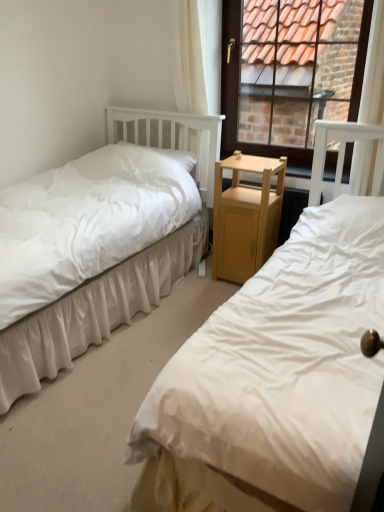
Question: Can you confirm if white fabric bed at left, the first bed positioned from the left, is positioned to the right of light wood nightstand at center?

Choices:
 (A) yes
 (B) no

Answer: (B)

Question: From the image's perspective, is white fabric bed at left, the first bed positioned from the left, on top of light wood nightstand at center?

Choices:
 (A) yes
 (B) no

Answer: (B)

Question: From a real-world perspective, is white fabric bed at left, the first bed positioned from the left, below light wood nightstand at center?

Choices:
 (A) no
 (B) yes

Answer: (A)

Question: Is white fabric bed at left, the first bed positioned from the left, turned away from light wood nightstand at center?

Choices:
 (A) yes
 (B) no

Answer: (B)

Question: Can you confirm if white fabric bed at left, the first bed positioned from the left, is taller than light wood nightstand at center?

Choices:
 (A) yes
 (B) no

Answer: (A)

Question: Is point (228, 260) positioned closer to the camera than point (208, 186)?

Choices:
 (A) closer
 (B) farther

Answer: (A)

Question: From the image's perspective, is light wood nightstand at center above or below white fabric bed at left, positioned as the second bed in right-to-left order?

Choices:
 (A) below
 (B) above

Answer: (B)

Question: From a real-world perspective, is light wood nightstand at center physically located above or below white fabric bed at left, positioned as the second bed in right-to-left order?

Choices:
 (A) below
 (B) above

Answer: (A)

Question: Do you think light wood nightstand at center is within white fabric bed at left, positioned as the second bed in right-to-left order, or outside of it?

Choices:
 (A) inside
 (B) outside

Answer: (B)

Question: From the image's perspective, is white fabric bed at left, which ranks as the first bed in right-to-left order, positioned above or below light wood nightstand at center?

Choices:
 (A) above
 (B) below

Answer: (B)

Question: Is white fabric bed at left, which ranks as the first bed in right-to-left order, bigger or smaller than light wood nightstand at center?

Choices:
 (A) small
 (B) big

Answer: (B)

Question: From their relative heights in the image, would you say white fabric bed at left, which ranks as the second bed in left-to-right order, is taller or shorter than light wood nightstand at center?

Choices:
 (A) short
 (B) tall

Answer: (B)

Question: Relative to light wood nightstand at center, is white fabric bed at left, which ranks as the second bed in left-to-right order, in front or behind?

Choices:
 (A) behind
 (B) front

Answer: (B)

Question: In terms of width, does white fabric bed at left, positioned as the second bed in right-to-left order, look wider or thinner when compared to white sheer curtain at upper center?

Choices:
 (A) thin
 (B) wide

Answer: (B)

Question: Do you think white fabric bed at left, positioned as the second bed in right-to-left order, is within white sheer curtain at upper center, or outside of it?

Choices:
 (A) outside
 (B) inside

Answer: (A)